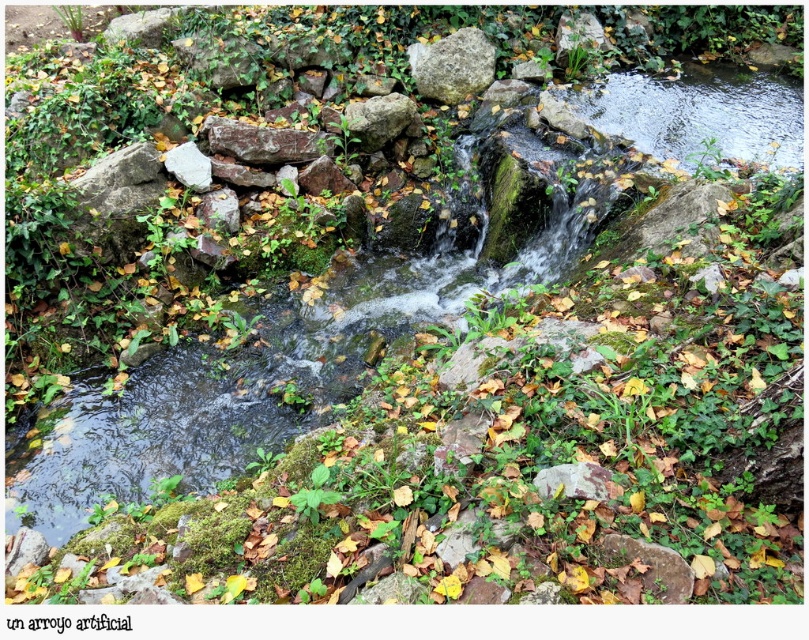
Question: Which point is farther from the camera taking this photo?

Choices:
 (A) (260, 150)
 (B) (352, 131)
 (C) (608, 492)
 (D) (438, 60)

Answer: (D)

Question: Among these points, which one is nearest to the camera?

Choices:
 (A) (485, 72)
 (B) (599, 476)

Answer: (B)

Question: Where is speckled gray rock at upper center located in relation to gray rough rock at center in the image?

Choices:
 (A) left
 (B) right

Answer: (B)

Question: Can you confirm if speckled gray rock at upper center is wider than rusty metallic rock at center?

Choices:
 (A) yes
 (B) no

Answer: (B)

Question: Which of these objects is positioned farthest from the rusty metallic rock at center?

Choices:
 (A) speckled gray rock at center
 (B) speckled gray rock at upper center

Answer: (A)

Question: Is the position of speckled gray rock at upper center more distant than that of rusty metallic rock at center?

Choices:
 (A) no
 (B) yes

Answer: (B)